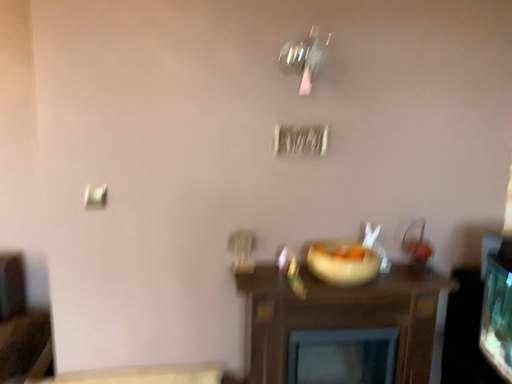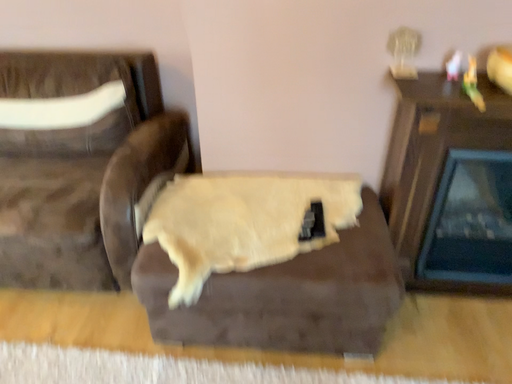
Question: How did the camera likely rotate when shooting the video?

Choices:
 (A) rotated left
 (B) rotated right

Answer: (A)